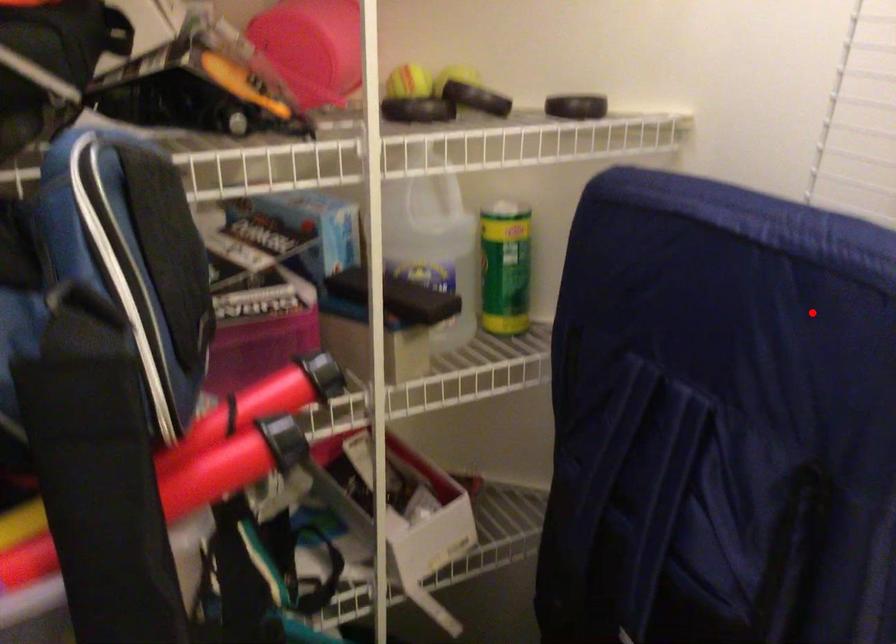
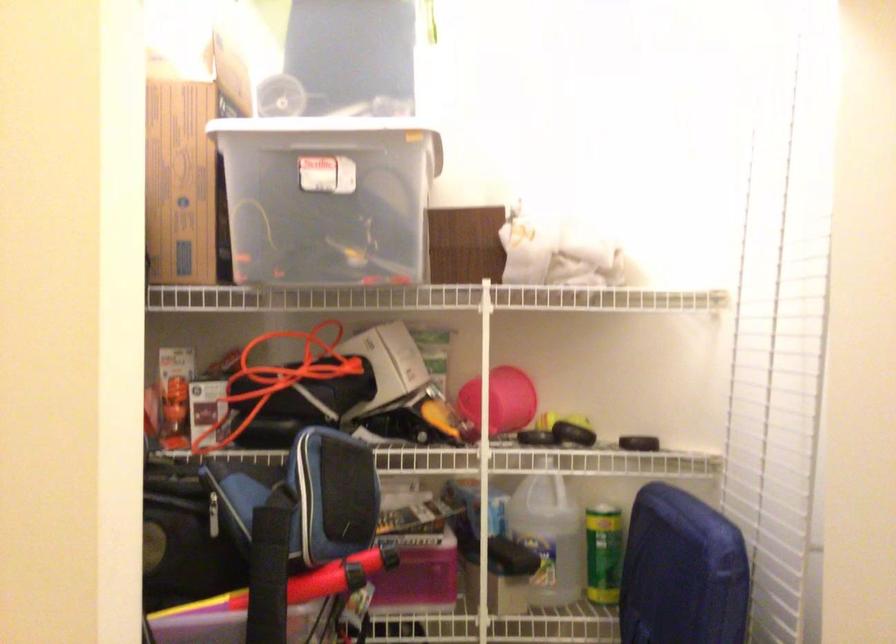
The point at the highlighted location is marked in the first image. Where is the corresponding point in the second image?

(682, 572)